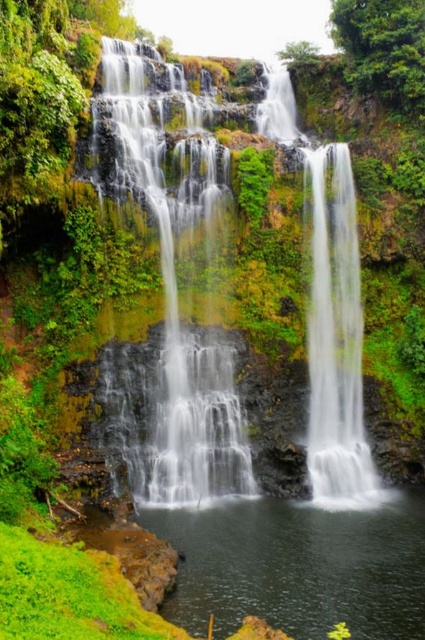
You are a drone operator trying to capture the waterfall from above. The drone has a camera that can focus on a specific point. If you want to capture the clear water at center, which coordinates should you aim for?

The clear water at center is located at coordinates point (299, 566), so you should aim the drone camera at point (299, 566) to capture it.

You are standing at the base of the waterfall and want to reach the highest point of the waterfall. You notice two points marked on the scene. Which point, point (172,358) or point (416,502), is closer to you and would be the first to reach?

Point (172,358) is further to the viewer than point (416,502). Therefore, point (416,502) is closer to you and would be the first to reach.